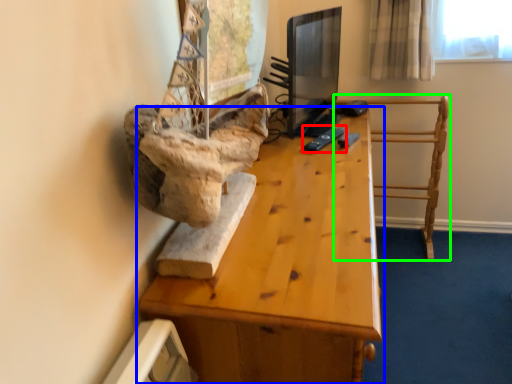
Question: Which object is the farthest from remote (highlighted by a red box)? Choose among these: table (highlighted by a blue box) or furniture (highlighted by a green box).

Choices:
 (A) table
 (B) furniture

Answer: (B)